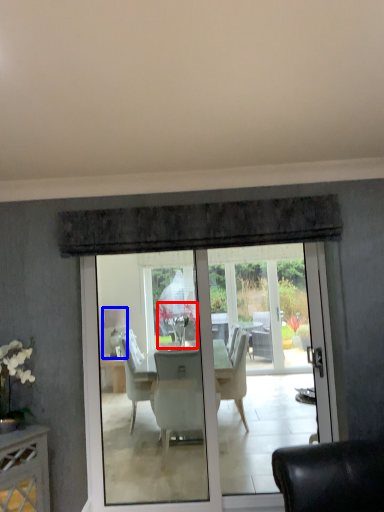
Question: Which point is closer to the camera, flower (highlighted by a red box) or lamp (highlighted by a blue box)?

Choices:
 (A) flower
 (B) lamp

Answer: (A)